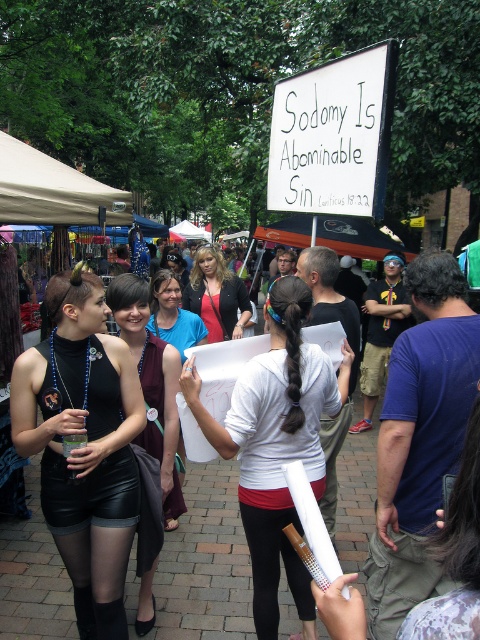
You are a photographer at the event and need to capture a candid shot of the two women without exposing too much skin. Which clothing item, the matte black shorts at lower left or the leather skirt at left, is more appropriate to focus on to avoid showing too much leg?

The leather skirt at left is longer than the matte black shorts at lower left, making it more appropriate to focus on to avoid showing too much leg.